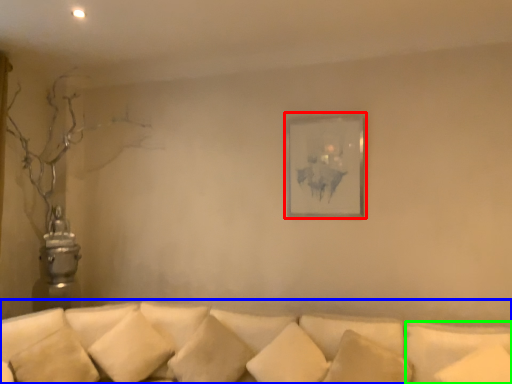
Question: Which object is positioned farthest from picture frame (highlighted by a red box)? Select from studio couch (highlighted by a blue box) and pillow (highlighted by a green box).

Choices:
 (A) studio couch
 (B) pillow

Answer: (A)